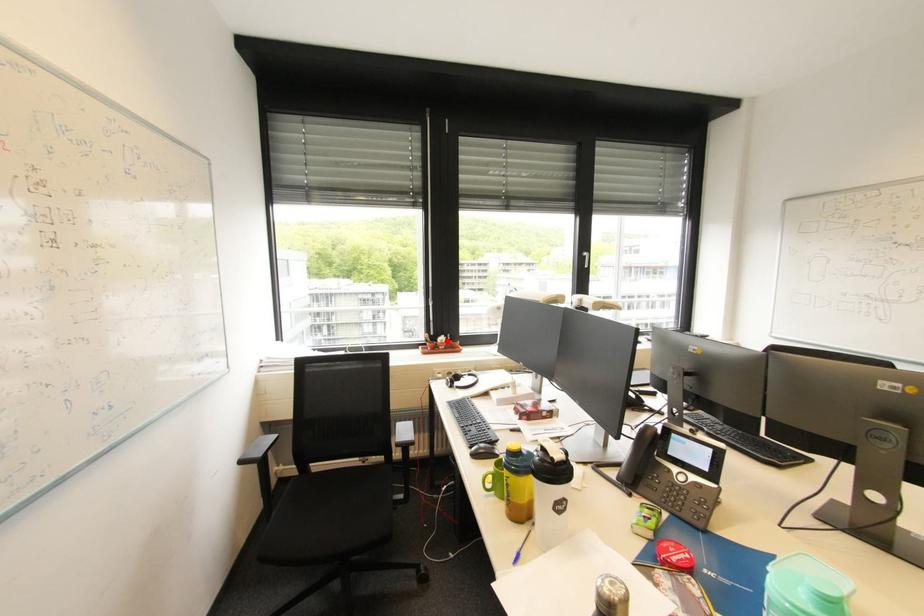
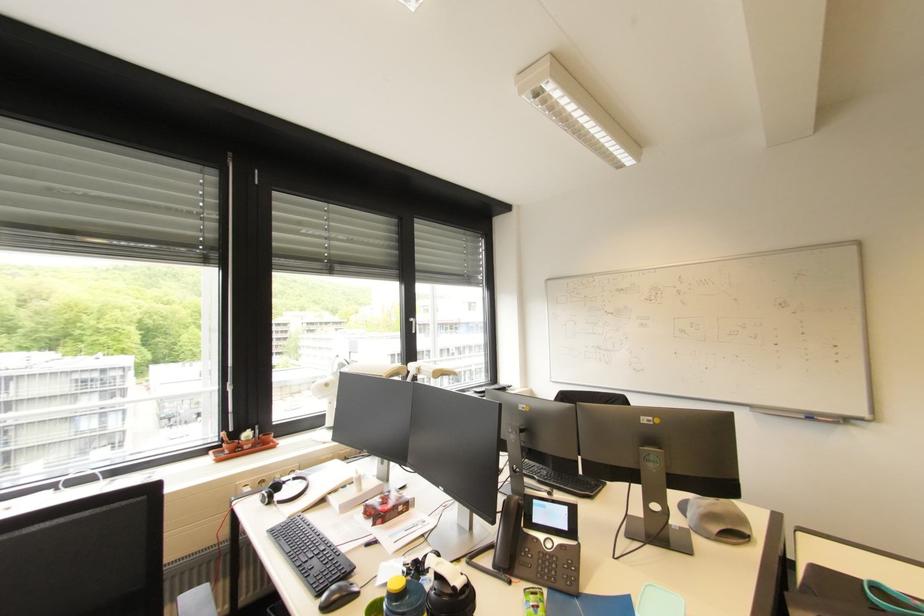
Locate, in the second image, the point that corresponds to the highlighted location in the first image.

(252, 438)